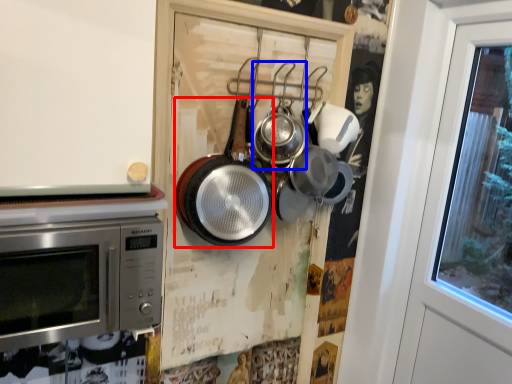
Question: Which of the following is the closest to the observer, frying pan (highlighted by a red box) or frying pan (highlighted by a blue box)?

Choices:
 (A) frying pan
 (B) frying pan

Answer: (A)